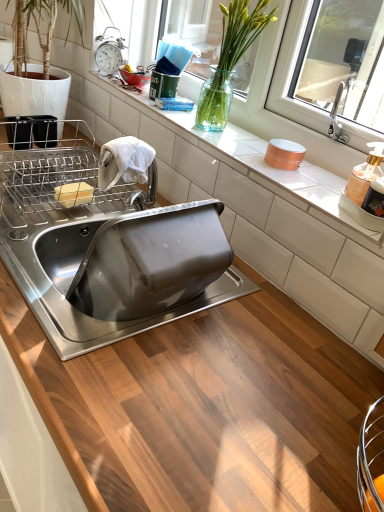
Question: In terms of size, does stainless steel sink at center appear bigger or smaller than metallic silver alarm clock at upper left?

Choices:
 (A) small
 (B) big

Answer: (B)

Question: From a real-world perspective, is stainless steel sink at center above or below metallic silver alarm clock at upper left?

Choices:
 (A) below
 (B) above

Answer: (A)

Question: Considering the real-world distances, which object is closest to the white glossy countertop at center?

Choices:
 (A) translucent glass vase at upper center
 (B) transparent glass vase at upper center
 (C) metallic silver alarm clock at upper left
 (D) translucent plastic soap dispenser at right
 (E) stainless steel sink at center

Answer: (A)

Question: Which object is the closest to the translucent glass vase at upper center?

Choices:
 (A) yellow butter at upper left
 (B) translucent plastic soap dispenser at right
 (C) stainless steel sink at center
 (D) metallic silver alarm clock at upper left
 (E) white glossy countertop at center

Answer: (E)